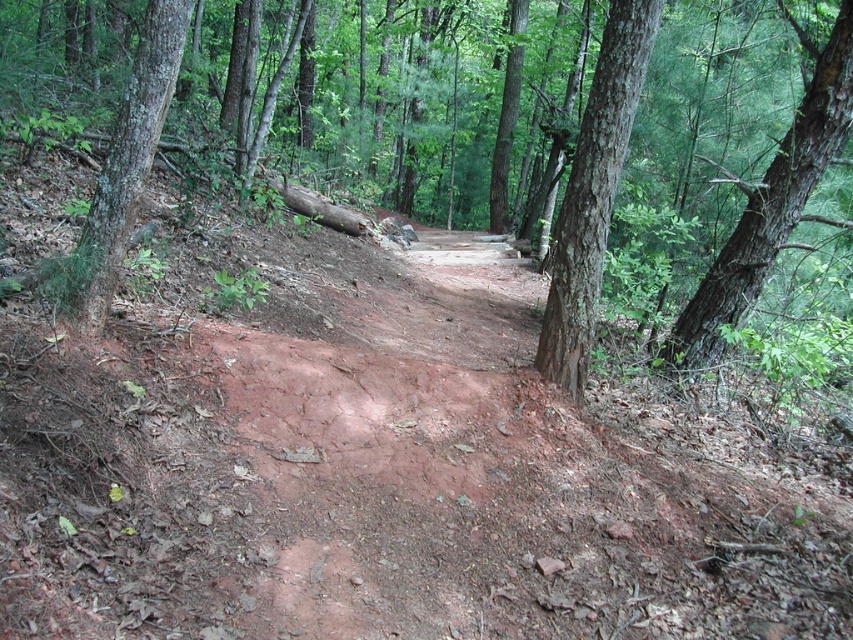
You are a hiker standing on the forest trail and want to take a photo of both the smooth bark tree at center and the brown rough bark tree at left. Which tree should you move closer to in order to capture both in the same frame?

You should move closer to the brown rough bark tree at left because the smooth bark tree at center is bigger and might be out of the frame if you stay too far back.

You are standing at the point marked as point (560,227) on the forest trail. If you want to take a photo of the entire trail using a camera with a 100mm lens, which has a field of view of 50 degrees, will the camera be able to capture the entire trail from your current position? Please explain your reasoning.

The distance between you and the camera is 2.46 meters. However, the question mentions capturing the entire trail with a 100mm lens having a 50 degree field of view. The field of view calculation requires knowing the width of the trail at that distance. Since the scene description doesn not provide the trail width, it is impossible to determine if the entire trail fits within the 50 degree field of view. Additional information about the trail width is needed to answer this accurately.

You are a hiker carrying a backpack and need to pass between the brown rough tree at center and the green rough bark tree at center right. The width of your backpack is 0.8 meters. Can you safely pass through the gap between them without touching either tree?

The distance between the brown rough tree at center and the green rough bark tree at center right is 3.61 meters. Since your backpack is only 0.8 meters wide, there is ample space to pass through the gap safely without touching either tree.